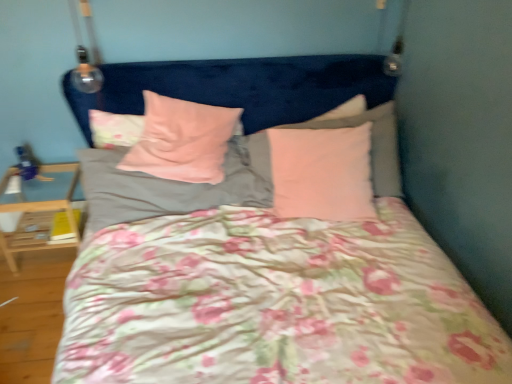
Question: Should I look upward or downward to see pink matte pillow at upper right, which is the second pillow in right-to-left order?

Choices:
 (A) down
 (B) up

Answer: (B)

Question: Are pink soft fabric pillow at center, the fourth pillow when ordered from right to left, and pink velvety pillow at center, the third pillow when ordered from right to left, far apart?

Choices:
 (A) yes
 (B) no

Answer: (B)

Question: Is pink soft fabric pillow at center, positioned as the 2th pillow in left-to-right order, thinner than pink velvety pillow at center, positioned as the 3th pillow in left-to-right order?

Choices:
 (A) no
 (B) yes

Answer: (B)

Question: From a real-world perspective, is pink soft fabric pillow at center, the fourth pillow when ordered from right to left, on top of pink velvety pillow at center, the third pillow when ordered from right to left?

Choices:
 (A) no
 (B) yes

Answer: (A)

Question: Can you confirm if pink soft fabric pillow at center, positioned as the 2th pillow in left-to-right order, is wider than pink velvety pillow at center, the third pillow when ordered from right to left?

Choices:
 (A) yes
 (B) no

Answer: (B)

Question: Considering the relative sizes of pink soft fabric pillow at center, positioned as the 2th pillow in left-to-right order, and pink velvety pillow at center, the third pillow when ordered from right to left, in the image provided, is pink soft fabric pillow at center, positioned as the 2th pillow in left-to-right order, bigger than pink velvety pillow at center, the third pillow when ordered from right to left,?

Choices:
 (A) yes
 (B) no

Answer: (A)

Question: Is pink soft fabric pillow at center, the fourth pillow when ordered from right to left, positioned before pink velvety pillow at center, positioned as the 3th pillow in left-to-right order?

Choices:
 (A) no
 (B) yes

Answer: (B)

Question: From a real-world perspective, is pink velvety pillow at center, the third pillow when ordered from right to left, on top of floral fabric pillow at upper left, placed as the fifth pillow when sorted from right to left?

Choices:
 (A) no
 (B) yes

Answer: (B)

Question: Considering the relative sizes of pink velvety pillow at center, the third pillow when ordered from right to left, and floral fabric pillow at upper left, the first pillow when ordered from left to right, in the image provided, is pink velvety pillow at center, the third pillow when ordered from right to left, bigger than floral fabric pillow at upper left, the first pillow when ordered from left to right,?

Choices:
 (A) no
 (B) yes

Answer: (B)

Question: Are pink velvety pillow at center, positioned as the 3th pillow in left-to-right order, and floral fabric pillow at upper left, placed as the fifth pillow when sorted from right to left, making contact?

Choices:
 (A) yes
 (B) no

Answer: (B)

Question: From a real-world perspective, is pink velvety pillow at center, the third pillow when ordered from right to left, located beneath floral fabric pillow at upper left, placed as the fifth pillow when sorted from right to left?

Choices:
 (A) yes
 (B) no

Answer: (B)

Question: Is the position of pink velvety pillow at center, the third pillow when ordered from right to left, more distant than that of floral fabric pillow at upper left, placed as the fifth pillow when sorted from right to left?

Choices:
 (A) no
 (B) yes

Answer: (A)

Question: From the image's perspective, is pink velvety pillow at center, the third pillow when ordered from right to left, over floral fabric pillow at upper left, placed as the fifth pillow when sorted from right to left?

Choices:
 (A) no
 (B) yes

Answer: (A)

Question: Does pink matte pillow at upper right, which ranks as the fourth pillow in left-to-right order, have a smaller size compared to pink velvety pillow at center, positioned as the 3th pillow in left-to-right order?

Choices:
 (A) yes
 (B) no

Answer: (B)